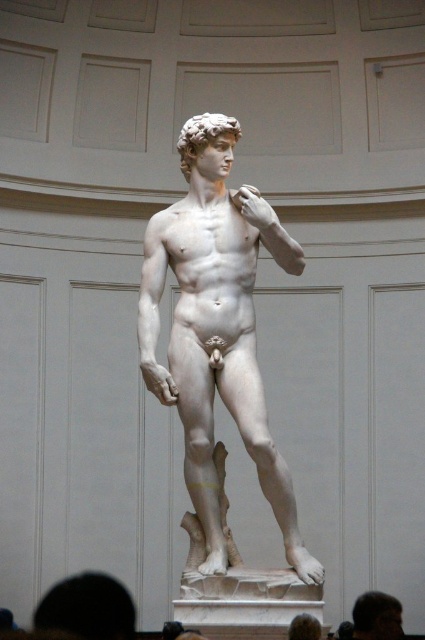
Question: Can you confirm if white marble statue at center is bigger than light brown hair at lower right?

Choices:
 (A) yes
 (B) no

Answer: (A)

Question: From the image, what is the correct spatial relationship of white marble statue at center in relation to light brown hair at lower right?

Choices:
 (A) left
 (B) right

Answer: (A)

Question: Among these points, which one is nearest to the camera?

Choices:
 (A) (184, 268)
 (B) (373, 616)

Answer: (A)

Question: Which point is closer to the camera taking this photo?

Choices:
 (A) (362, 604)
 (B) (223, 208)

Answer: (B)

Question: Which of the following is the farthest from the observer?

Choices:
 (A) light brown hair at lower right
 (B) white marble statue at center

Answer: (A)

Question: Can you confirm if white marble statue at center is positioned to the left of light brown hair at lower right?

Choices:
 (A) yes
 (B) no

Answer: (A)